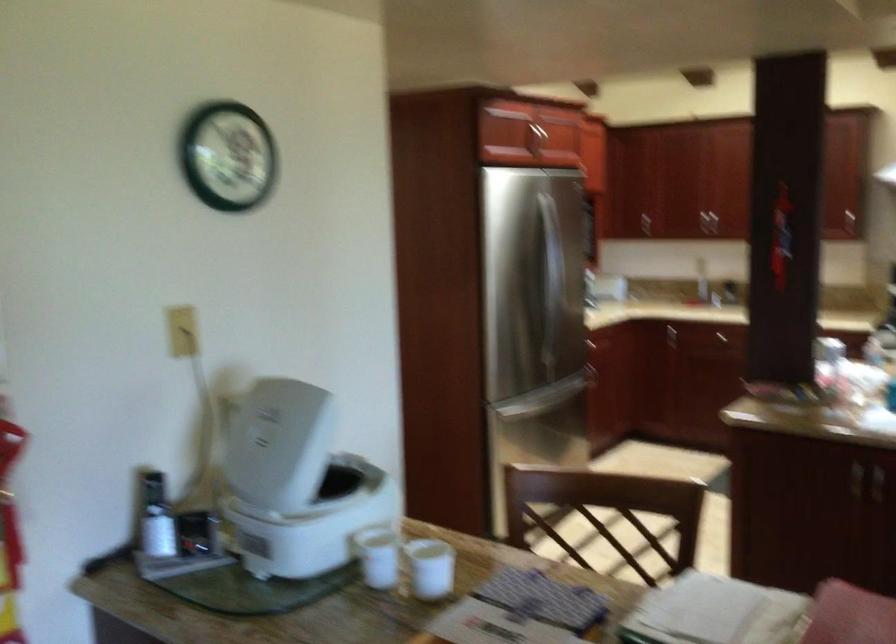
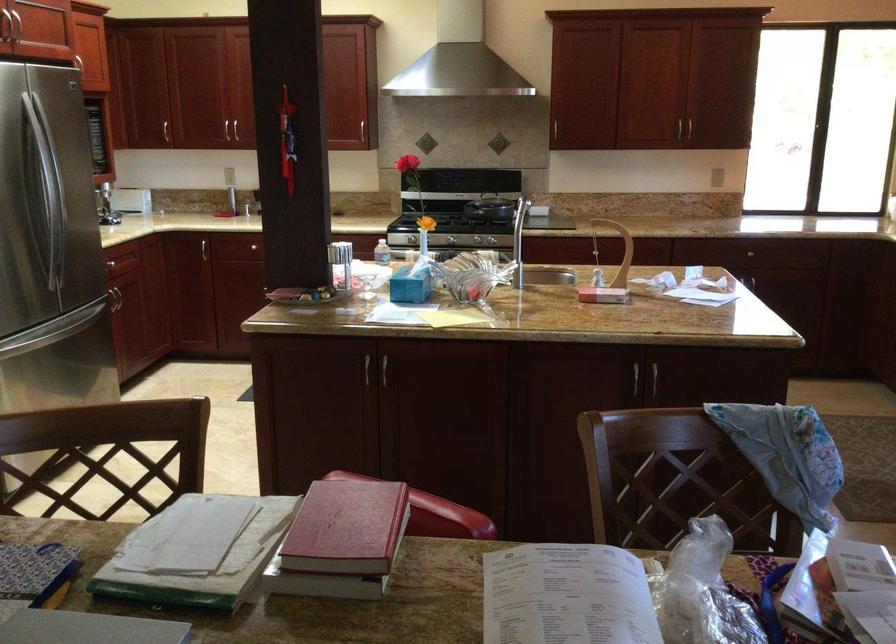
Where in the second image is the point corresponding to point 662,213 from the first image?

(165, 131)